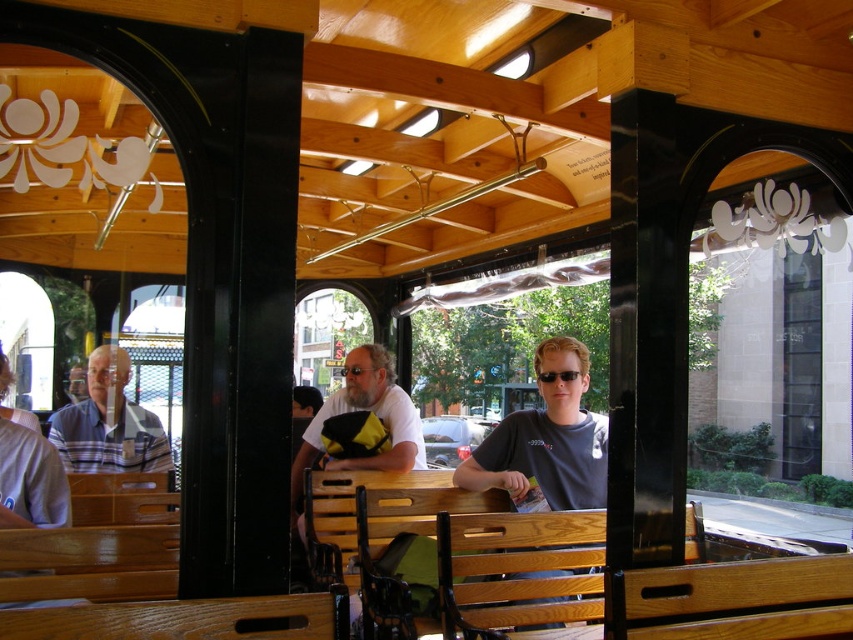
Does striped fabric shirt at left have a lesser height compared to matte white shirt at center?

Correct, striped fabric shirt at left is not as tall as matte white shirt at center.

Is striped fabric shirt at left positioned before matte white shirt at center?

No.

Locate an element on the screen. The width and height of the screenshot is (853, 640). striped fabric shirt at left is located at coordinates (109, 422).

Identify the location of striped fabric shirt at left. The image size is (853, 640). (x=109, y=422).

Does wooden table at center have a lesser width compared to striped fabric shirt at left?

Yes.

Consider the image. Can you confirm if wooden table at center is taller than striped fabric shirt at left?

No.

Is point (206, 620) less distant than point (164, 449)?

That is True.

Where is `wooden table at center`? This screenshot has height=640, width=853. wooden table at center is located at coordinates (187, 620).

Based on the photo, is wooden table at center taller than matte white shirt at center?

No, wooden table at center is not taller than matte white shirt at center.

Does wooden table at center lie behind matte white shirt at center?

That is False.

Does point (91, 611) come farther from viewer compared to point (383, 378)?

No, (91, 611) is in front of (383, 378).

The image size is (853, 640). What are the coordinates of `wooden table at center` in the screenshot? It's located at (187, 620).